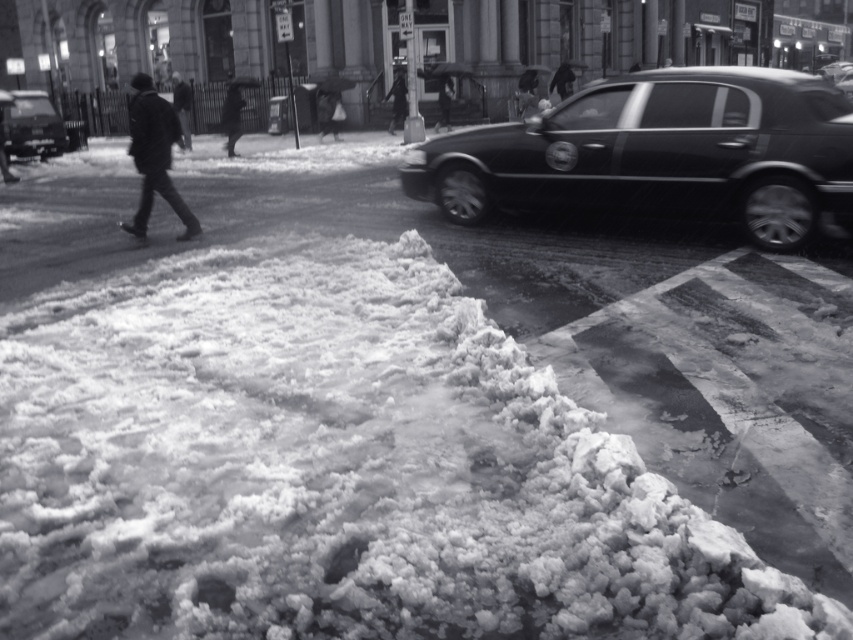
You are a pedestrian trying to cross the street in the snowy night scene. You see a dark wool coat at left and a shiny black car at left. Which object is closer to the center of the street?

The dark wool coat at left is to the right of the shiny black car at left, so the shiny black car at left is closer to the center of the street.

You are a pedestrian trying to cross the street in the snowy scene. You see a shiny black sedan at right and a shiny black car at left. Which car is nearer to you?

The shiny black sedan at right is closer to the viewer than the shiny black car at left, so the shiny black sedan at right is nearer to you.